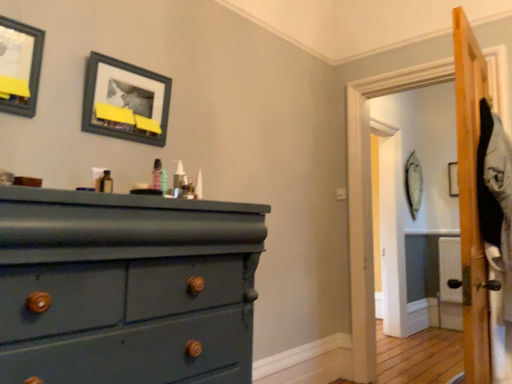
Question: Is translucent plastic pump at center, acting as the first toiletry starting from the right, in front of or behind wooden picture frame at upper right, the third picture frame when ordered from front to back, in the image?

Choices:
 (A) behind
 (B) front

Answer: (B)

Question: From a real-world perspective, is translucent plastic pump at center, acting as the first toiletry starting from the right, positioned above or below wooden picture frame at upper right, the third picture frame when ordered from front to back?

Choices:
 (A) above
 (B) below

Answer: (B)

Question: Which of these objects is positioned farthest from the translucent plastic pump at center, acting as the first toiletry starting from the right?

Choices:
 (A) matte black picture frame at upper center, the 2th picture frame when ordered from right to left
 (B) teal matte wood dresser at left
 (C) translucent plastic spray bottle at center, which is the 2th toiletry in right-to-left order
 (D) matte black picture frame at upper left, the first picture frame in the front-to-back sequence
 (E) wooden picture frame at upper right, positioned as the 1th picture frame in back-to-front order

Answer: (E)

Question: Estimate the real-world distances between objects in this image. Which object is closer to the translucent plastic pump at center, acting as the first toiletry starting from the right?

Choices:
 (A) teal matte wood dresser at left
 (B) matte black picture frame at upper left, which appears as the third picture frame when viewed from the right
 (C) wooden picture frame at upper right, placed as the third picture frame when sorted from left to right
 (D) matte black picture frame at upper center, acting as the second picture frame starting from the back
 (E) translucent plastic spray bottle at center, which is the 2th toiletry in right-to-left order

Answer: (E)